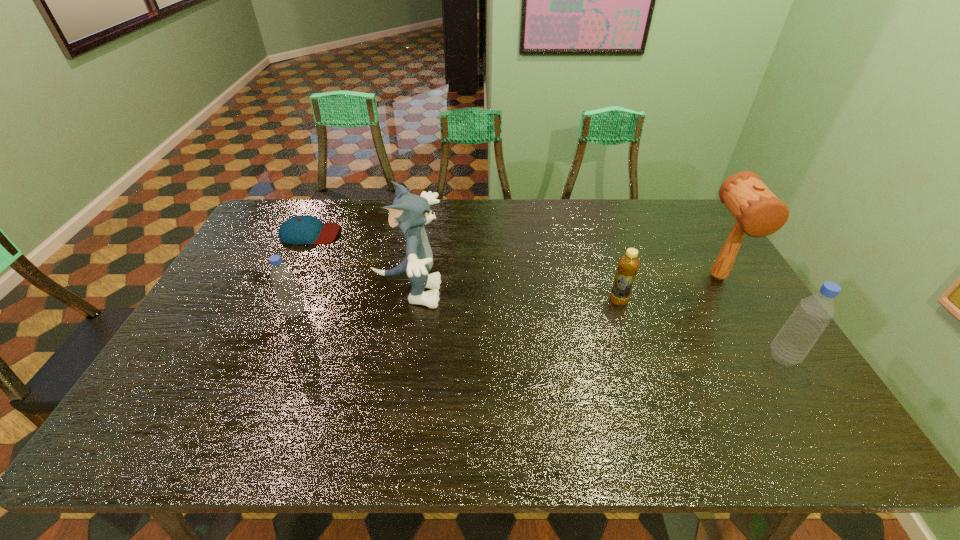
Identify the location of vacant space that's between the fourth object from left to right and the leftmost bottle. This screenshot has height=540, width=960. pos(457,306).

This screenshot has width=960, height=540. Find the location of `unoccupied position between the fourth object from right to left and the second bottle from right to left`. unoccupied position between the fourth object from right to left and the second bottle from right to left is located at coordinates (514, 296).

Where is `free space between the tallest bottle and the mallet`? free space between the tallest bottle and the mallet is located at coordinates (751, 317).

Where is `free point between the second bottle from left to right and the leftmost bottle`? free point between the second bottle from left to right and the leftmost bottle is located at coordinates (457, 306).

This screenshot has height=540, width=960. I want to click on vacant area that lies between the second bottle from left to right and the mallet, so click(668, 289).

At what (x,y) coordinates should I click in order to perform the action: click on the second closest object to the baseball cap. Please return your answer as a coordinate pair (x, y). The width and height of the screenshot is (960, 540). Looking at the image, I should click on (289, 296).

Find the location of a particular element. object that stands as the fifth closest to the shortest object is located at coordinates (793, 342).

Point out which bottle is positioned as the nearest to the second bottle from left to right. Please provide its 2D coordinates. Your answer should be formatted as a tuple, i.e. [(x, y)], where the tuple contains the x and y coordinates of a point satisfying the conditions above.

[(793, 342)]

Where is `bottle that is the nearest to the baseball cap`? This screenshot has width=960, height=540. bottle that is the nearest to the baseball cap is located at coordinates (289, 296).

Where is `free space that satisfies the following two spatial constraints: 1. with the bill of the shortest object facing forward; 2. on the right side of the nearest object`? The height and width of the screenshot is (540, 960). free space that satisfies the following two spatial constraints: 1. with the bill of the shortest object facing forward; 2. on the right side of the nearest object is located at coordinates (251, 357).